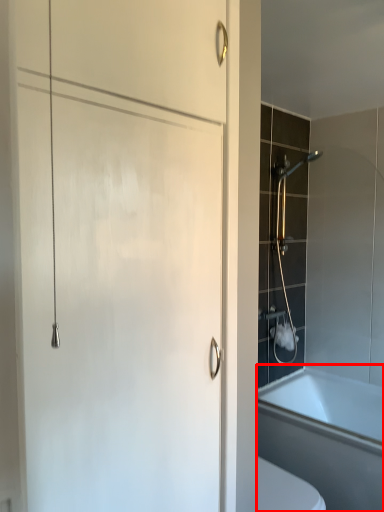
Question: From the image's perspective, considering the relative positions of bathtub (annotated by the red box) and shower in the image provided, where is bathtub (annotated by the red box) located with respect to the staircase?

Choices:
 (A) above
 (B) below

Answer: (B)